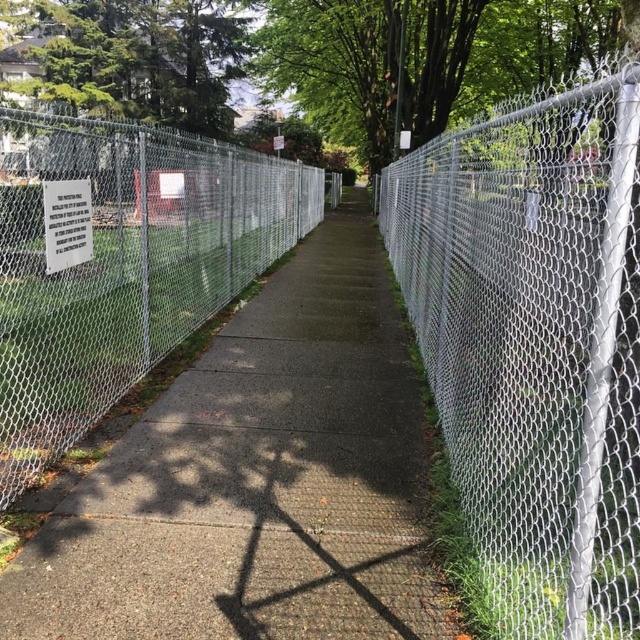
Is gray concrete sidewalk at center thinner than silver chain-link fence at right?

Indeed, gray concrete sidewalk at center has a lesser width compared to silver chain-link fence at right.

Is gray concrete sidewalk at center above silver chain-link fence at right?

Actually, gray concrete sidewalk at center is below silver chain-link fence at right.

The width and height of the screenshot is (640, 640). Find the location of `gray concrete sidewalk at center`. gray concrete sidewalk at center is located at coordinates (257, 481).

I want to click on gray concrete sidewalk at center, so click(x=257, y=481).

Is point (196, 376) more distant than point (68, 188)?

Yes, it is.

Locate an element on the screen. The width and height of the screenshot is (640, 640). gray concrete sidewalk at center is located at coordinates (257, 481).

Measure the distance between point [412,381] and camera.

They are 17.03 feet apart.

Which is below, gray concrete sidewalk at center or silver chain-link fence at left?

gray concrete sidewalk at center is below.

Is point (326, 520) positioned before point (70, 426)?

That is True.

Locate an element on the screen. The height and width of the screenshot is (640, 640). gray concrete sidewalk at center is located at coordinates (257, 481).